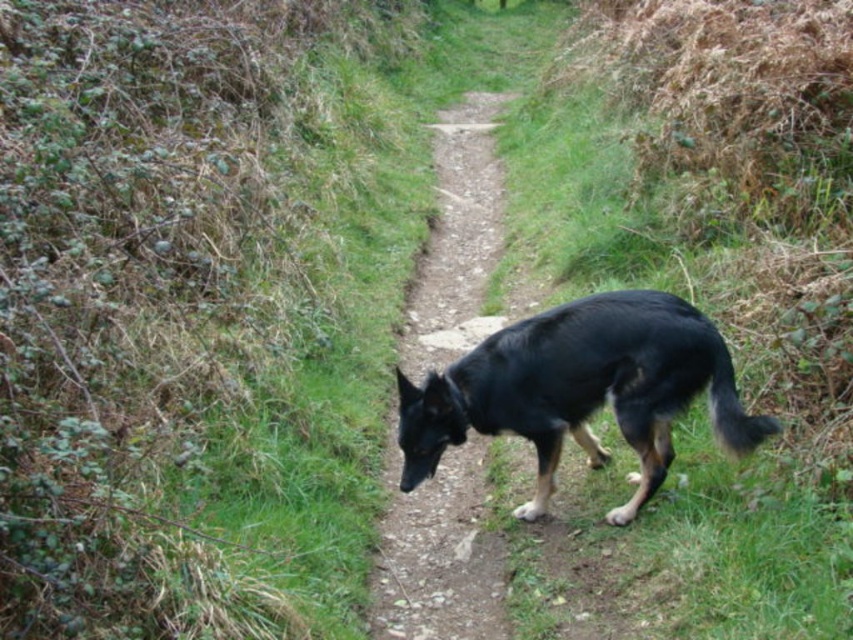
You are standing at the point labeled point (622, 390) and want to walk to the point labeled point (431, 616) along the path. Given that the path is narrow and uneven, will you have to walk towards the German Shepherd dog positioned on the right side of the path?

Yes, you will have to walk towards the German Shepherd dog positioned on the right side of the path because the path is narrow and the dog is on the right side, so moving towards the point requires navigating closer to the dog.

You are a hiker walking along the dirt path at center and see the black glossy dog at center nearby. Is the dog positioned above or below the path?

The black glossy dog at center is located below the dirt path at center, so the dog is positioned below the path.